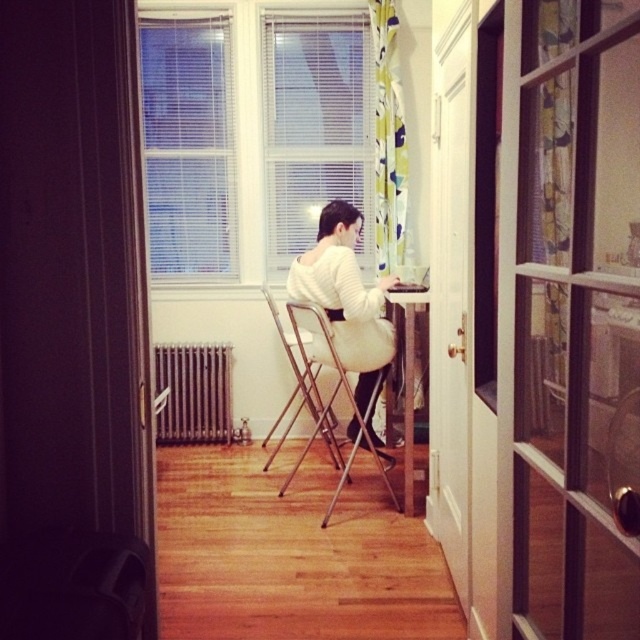
Question: Which point is closer to the camera taking this photo?

Choices:
 (A) (614, 602)
 (B) (282, 326)
 (C) (426, 300)
 (D) (385, 484)

Answer: (A)

Question: Considering the real-world distances, which object is farthest from the clear glass screen door at center?

Choices:
 (A) white blinds at upper center
 (B) white soft sweater at center

Answer: (A)

Question: Does clear glass screen door at center appear on the left side of wooden table at center?

Choices:
 (A) no
 (B) yes

Answer: (B)

Question: Does white blinds at upper center lie behind metallic silver folding chair at center?

Choices:
 (A) no
 (B) yes

Answer: (B)

Question: Is white blinds at upper center behind wooden table at center?

Choices:
 (A) yes
 (B) no

Answer: (A)

Question: Which of the following is the closest to the observer?

Choices:
 (A) (173, 442)
 (B) (365, 369)

Answer: (B)